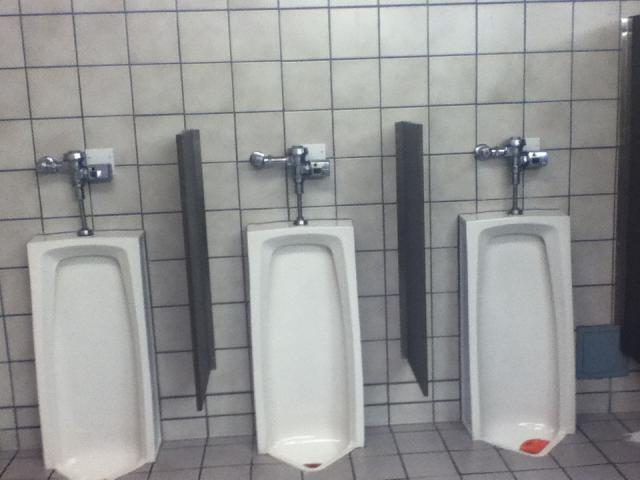
You are a GUI agent. You are given a task and a screenshot of the screen. Output one action in this format:
    pyautogui.click(x=<x>, y=<y>)
    Task: Click on the box
    This screenshot has height=480, width=640.
    Given the screenshot: What is the action you would take?
    pyautogui.click(x=604, y=358)